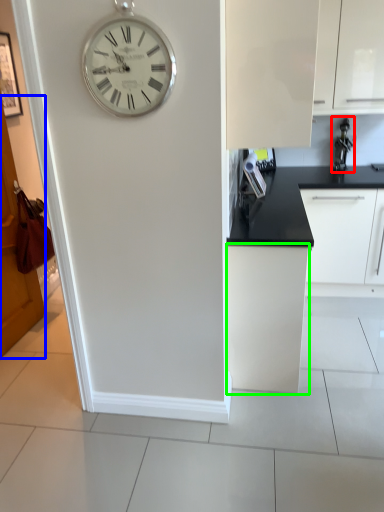
Question: Which is farther away from appliance (highlighted by a red box)? door (highlighted by a blue box) or cabinetry (highlighted by a green box)?

Choices:
 (A) door
 (B) cabinetry

Answer: (A)